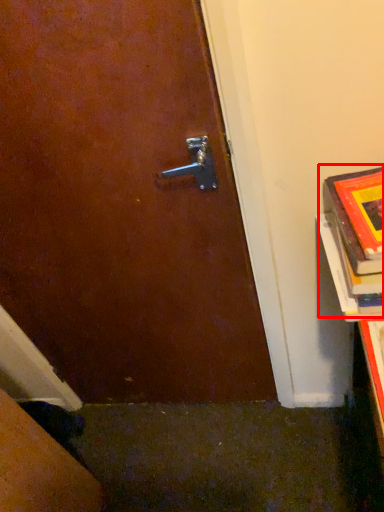
Question: Observing the image, what is the correct spatial positioning of book (annotated by the red box) in reference to book cover?

Choices:
 (A) right
 (B) left

Answer: (A)